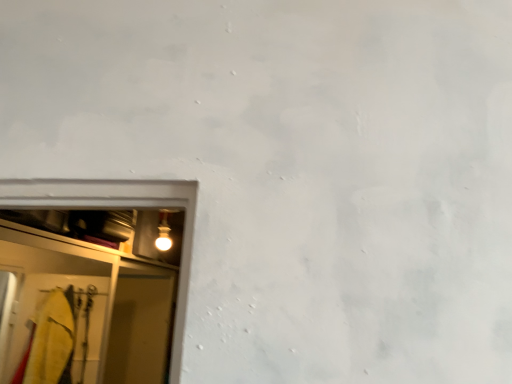
Locate an element on the screen. Image resolution: width=512 pixels, height=384 pixels. yellow fabric at left is located at coordinates pyautogui.click(x=115, y=209).

What do you see at coordinates (115, 209) in the screenshot? I see `yellow fabric at left` at bounding box center [115, 209].

You are a GUI agent. You are given a task and a screenshot of the screen. Output one action in this format:
    pyautogui.click(x=<x>, y=<y>)
    Task: Click on the yellow fabric at left
    This screenshot has width=512, height=384.
    Given the screenshot: What is the action you would take?
    pyautogui.click(x=115, y=209)